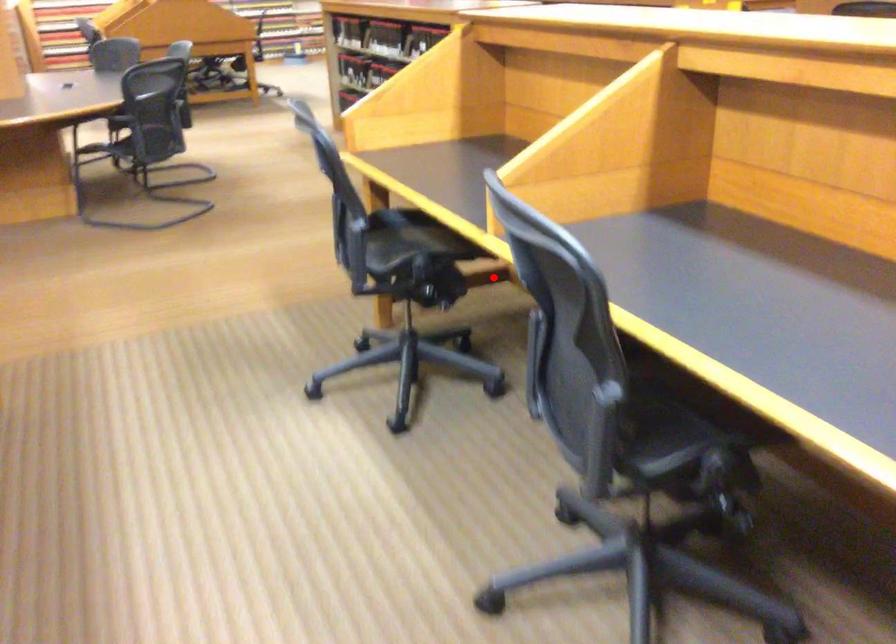
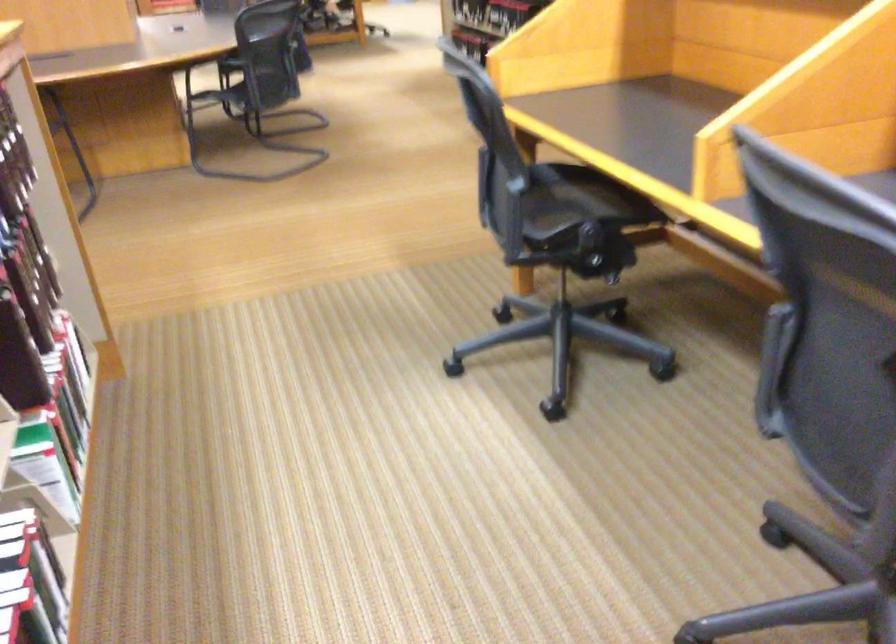
Question: I am providing you with two images of the same scene from different viewpoints. In image1, a red point is highlighted. Considering the same 3D point in image2, which of the following is correct?

Choices:
 (A) It is closer
 (B) It is farther

Answer: (A)